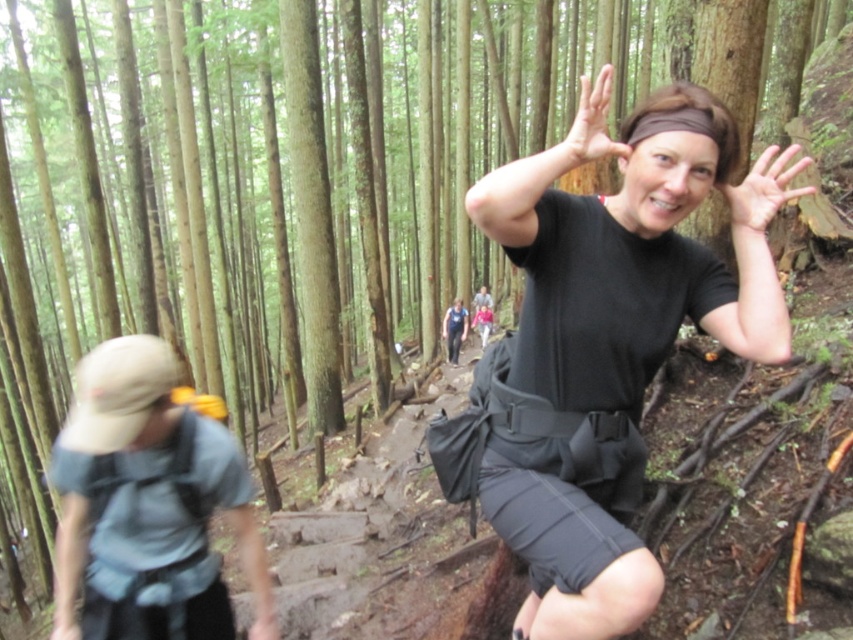
Does black matte shorts at center have a lesser height compared to matte black hand at upper center?

Yes, black matte shorts at center is shorter than matte black hand at upper center.

Which is above, black matte shorts at center or matte black hand at upper center?

matte black hand at upper center is above.

What do you see at coordinates (628, 260) in the screenshot?
I see `black matte shorts at center` at bounding box center [628, 260].

Find the location of a particular element. This screenshot has width=853, height=640. black matte shorts at center is located at coordinates (628, 260).

Is point (747, 228) less distant than point (573, 168)?

No, it is not.

Is smooth skin hand at upper center below matte black hand at upper center?

Yes, smooth skin hand at upper center is below matte black hand at upper center.

Between point (775, 173) and point (592, 145), which one is positioned in front?

Point (592, 145) is in front.

The image size is (853, 640). I want to click on smooth skin hand at upper center, so click(x=763, y=193).

Between black matte shorts at center and light blue fabric shirt at left, which one has less height?

Standing shorter between the two is light blue fabric shirt at left.

Which is below, black matte shorts at center or light blue fabric shirt at left?

black matte shorts at center is below.

Identify the location of black matte shorts at center. The height and width of the screenshot is (640, 853). (628, 260).